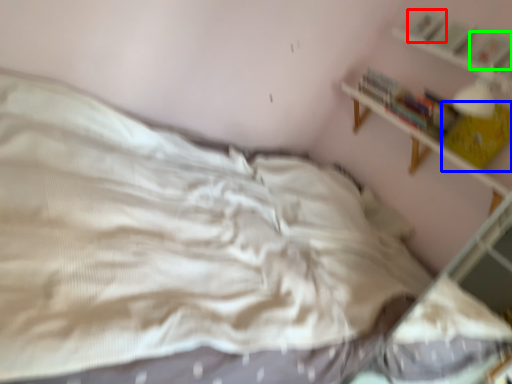
Question: Which is farther away from book (highlighted by a red box)? book (highlighted by a blue box) or book (highlighted by a green box)?

Choices:
 (A) book
 (B) book

Answer: (A)